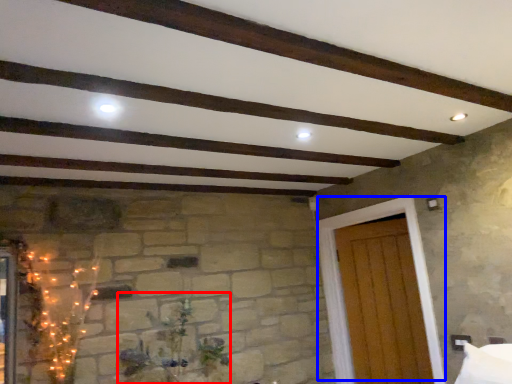
Question: Which of the following is the farthest to the observer, plant (highlighted by a red box) or door (highlighted by a blue box)?

Choices:
 (A) plant
 (B) door

Answer: (B)